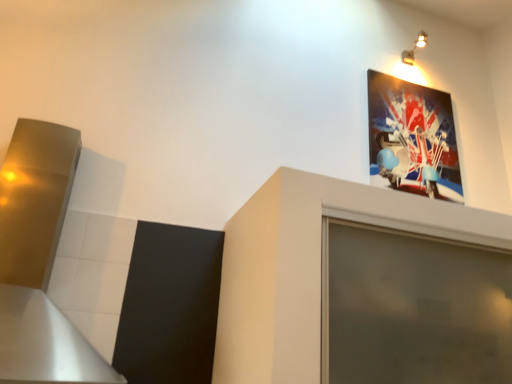
Question: From a real-world perspective, is brushed metal exhaust hood at left above or below metallic spotlights at upper right?

Choices:
 (A) above
 (B) below

Answer: (B)

Question: Looking at their shapes, would you say brushed metal exhaust hood at left is wider or thinner than metallic spotlights at upper right?

Choices:
 (A) thin
 (B) wide

Answer: (B)

Question: Which object is positioned closest to the metallic spotlights at upper right?

Choices:
 (A) brushed metal exhaust hood at left
 (B) matte plastic picture frame at upper right

Answer: (B)

Question: Which object is the farthest from the metallic spotlights at upper right?

Choices:
 (A) brushed metal exhaust hood at left
 (B) matte plastic picture frame at upper right

Answer: (A)